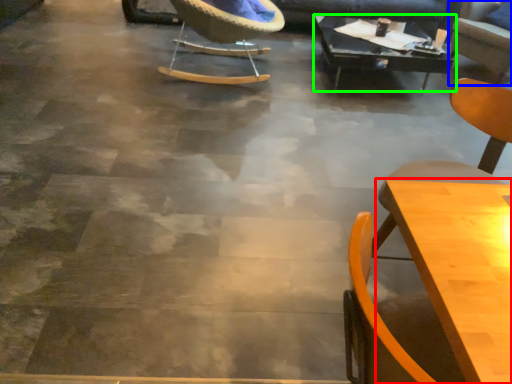
Question: Which is farther away from table (highlighted by a red box)? chair (highlighted by a blue box) or table (highlighted by a green box)?

Choices:
 (A) chair
 (B) table

Answer: (A)